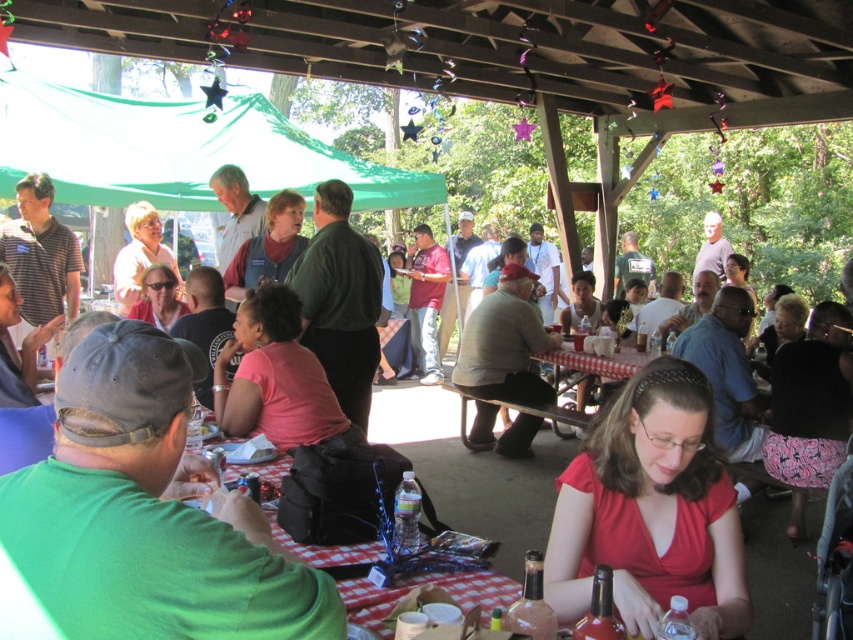
You are a photographer taking a picture of the green matte shirt at center and the pink fabric shirt at center. Which shirt will appear larger in the photo?

The green matte shirt at center will appear larger in the photo because it is closer to the viewer than the pink fabric shirt at center.

You are standing at the entrance of the pavilion and want to take a photo of two specific points in the scene. The first point is at coordinates point (x=605, y=480) and the second is at point (x=581, y=419). Which point will appear larger in your camera view?

Point (x=605, y=480) is closer to the camera than point (x=581, y=419), so it will appear larger in the camera view.